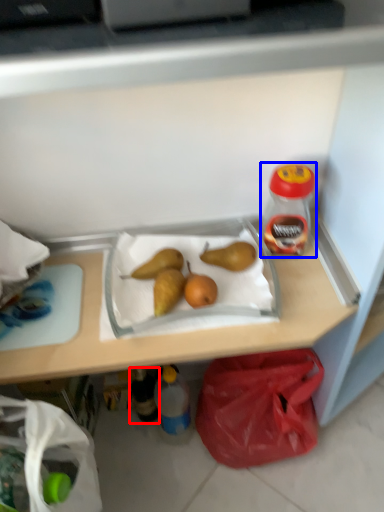
Question: Which object is further to the camera taking this photo, bottle (highlighted by a red box) or bottle (highlighted by a blue box)?

Choices:
 (A) bottle
 (B) bottle

Answer: (A)